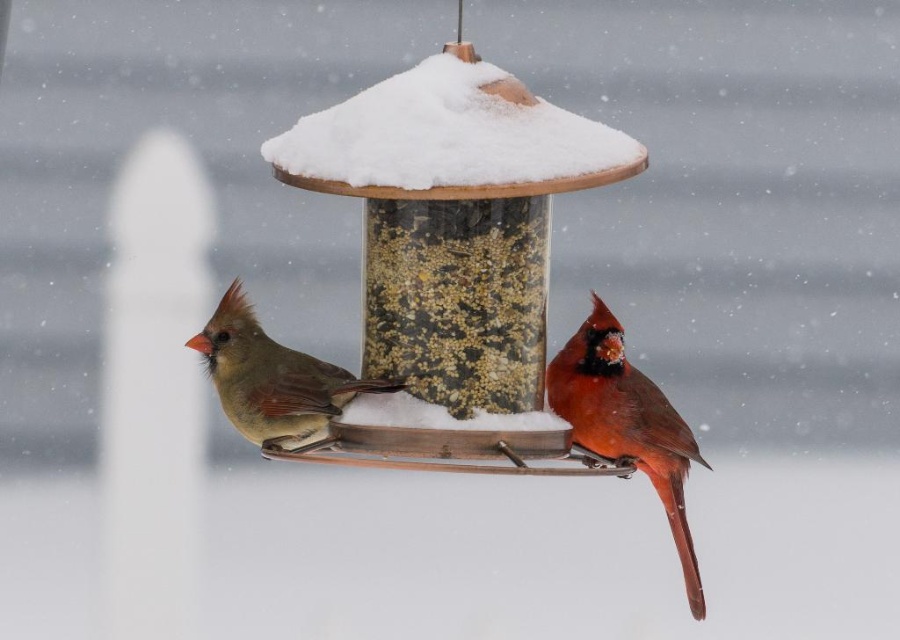
You are a birder observing the scene. You notice the shiny red cardinal at center and the matte brown bird at left. Which bird is closer to the observer?

The shiny red cardinal at center is closer to the observer because the matte brown bird at left is behind it.

What is the exact coordinate of the white fluffy snow at center in the image?

The white fluffy snow at center is located at point (450,140).